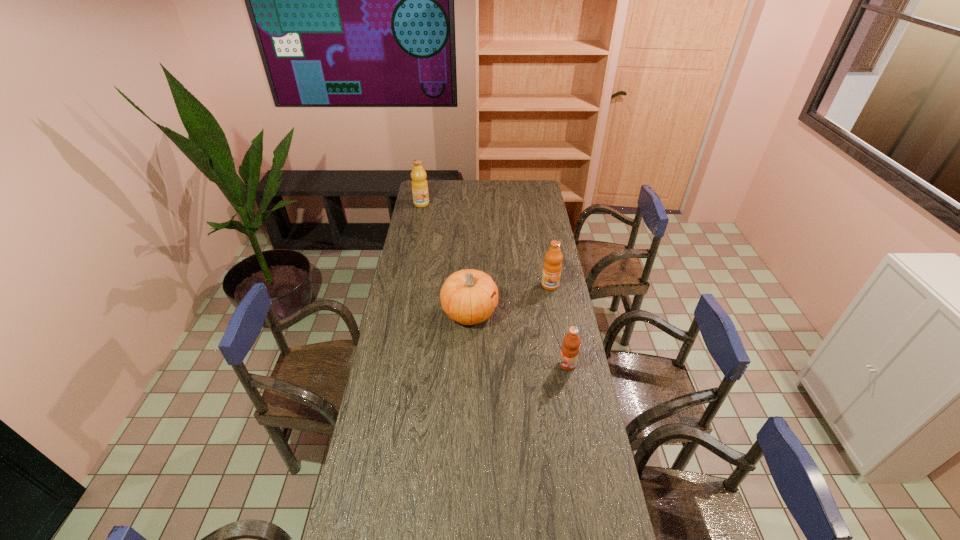
Identify the location of free space located 0.110m on the front label of the shortest object. (531, 364).

Locate an element on the screen. The height and width of the screenshot is (540, 960). free space located on the front label of the shortest object is located at coordinates (525, 364).

Locate an element on the screen. vacant region located on the front label of the shortest object is located at coordinates (x=465, y=364).

This screenshot has width=960, height=540. In order to click on object present at the far edge in this screenshot , I will do `click(419, 183)`.

Where is `object located at the left edge`? Image resolution: width=960 pixels, height=540 pixels. object located at the left edge is located at coordinates (419, 183).

Find the location of a particular element. object positioned at the far left corner is located at coordinates (419, 183).

The image size is (960, 540). What are the coordinates of `vacant area at the far edge of the desktop` in the screenshot? It's located at (505, 200).

I want to click on vacant region at the left edge, so click(395, 324).

Where is `vacant area at the right edge of the desktop`? This screenshot has height=540, width=960. vacant area at the right edge of the desktop is located at coordinates (534, 222).

Image resolution: width=960 pixels, height=540 pixels. In order to click on vacant area between the second nearest fruit juice and the third farthest object in this screenshot , I will do `click(510, 299)`.